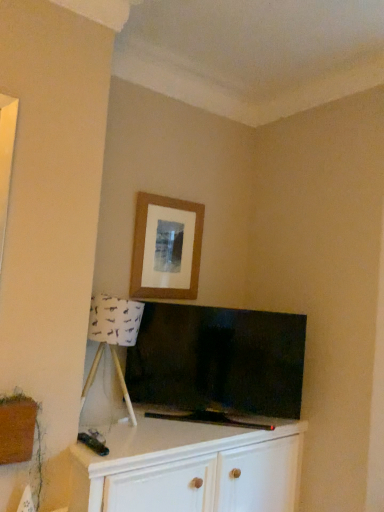
Question: Would you say white wood cabinet at lower center is outside flat-screen tv at center?

Choices:
 (A) yes
 (B) no

Answer: (A)

Question: Does white wood cabinet at lower center have a smaller size compared to flat-screen tv at center?

Choices:
 (A) yes
 (B) no

Answer: (B)

Question: From the image's perspective, is white wood cabinet at lower center on top of flat-screen tv at center?

Choices:
 (A) no
 (B) yes

Answer: (A)

Question: Does white wood cabinet at lower center have a greater height compared to flat-screen tv at center?

Choices:
 (A) no
 (B) yes

Answer: (B)

Question: Is white wood cabinet at lower center wider than flat-screen tv at center?

Choices:
 (A) yes
 (B) no

Answer: (A)

Question: Is white wood cabinet at lower center to the left of flat-screen tv at center from the viewer's perspective?

Choices:
 (A) no
 (B) yes

Answer: (B)

Question: From the image's perspective, is white fabric lampshade at lower left on white wood cabinet at lower center?

Choices:
 (A) yes
 (B) no

Answer: (A)

Question: Is white fabric lampshade at lower left behind white wood cabinet at lower center?

Choices:
 (A) yes
 (B) no

Answer: (A)

Question: Considering the relative sizes of white fabric lampshade at lower left and white wood cabinet at lower center in the image provided, is white fabric lampshade at lower left thinner than white wood cabinet at lower center?

Choices:
 (A) yes
 (B) no

Answer: (A)

Question: Is white fabric lampshade at lower left not within white wood cabinet at lower center?

Choices:
 (A) yes
 (B) no

Answer: (A)

Question: From a real-world perspective, does white fabric lampshade at lower left sit lower than white wood cabinet at lower center?

Choices:
 (A) yes
 (B) no

Answer: (B)

Question: Can you confirm if white fabric lampshade at lower left is wider than white wood cabinet at lower center?

Choices:
 (A) yes
 (B) no

Answer: (B)

Question: Is wooden picture frame at upper center in contact with white fabric lampshade at lower left?

Choices:
 (A) no
 (B) yes

Answer: (A)